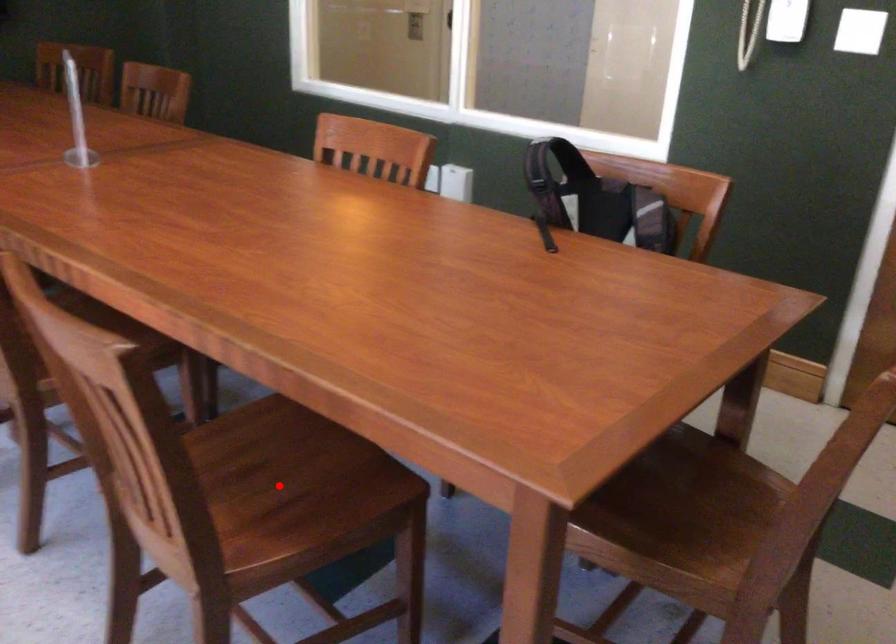
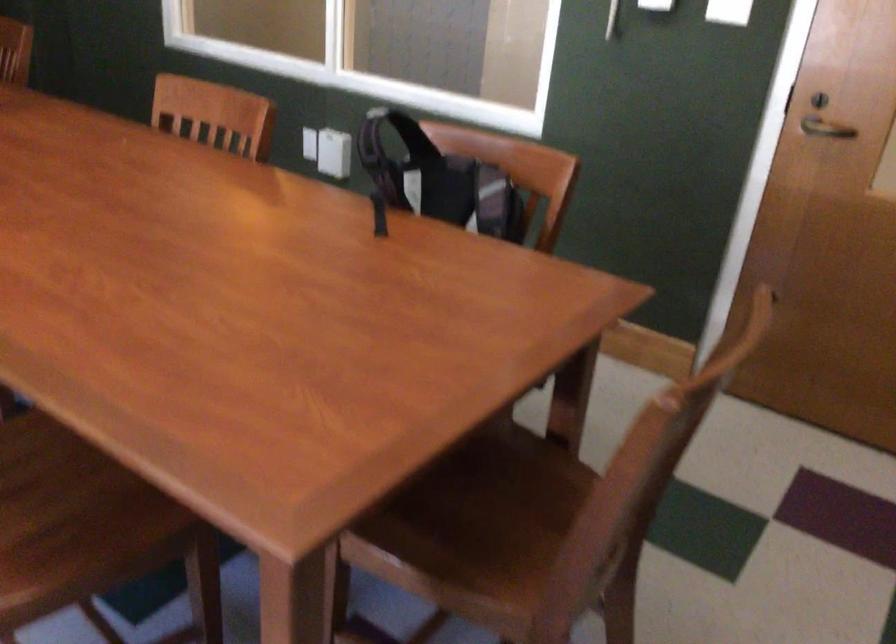
The point at the highlighted location is marked in the first image. Where is the corresponding point in the second image?

(52, 498)